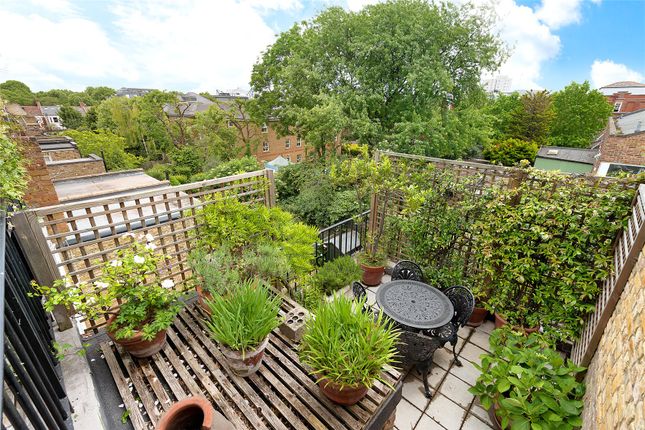
This screenshot has width=645, height=430. What are the coordinates of `pots` in the screenshot? It's located at (344, 390), (248, 355), (206, 296), (152, 331), (188, 403), (497, 412), (366, 268), (473, 307), (508, 325).